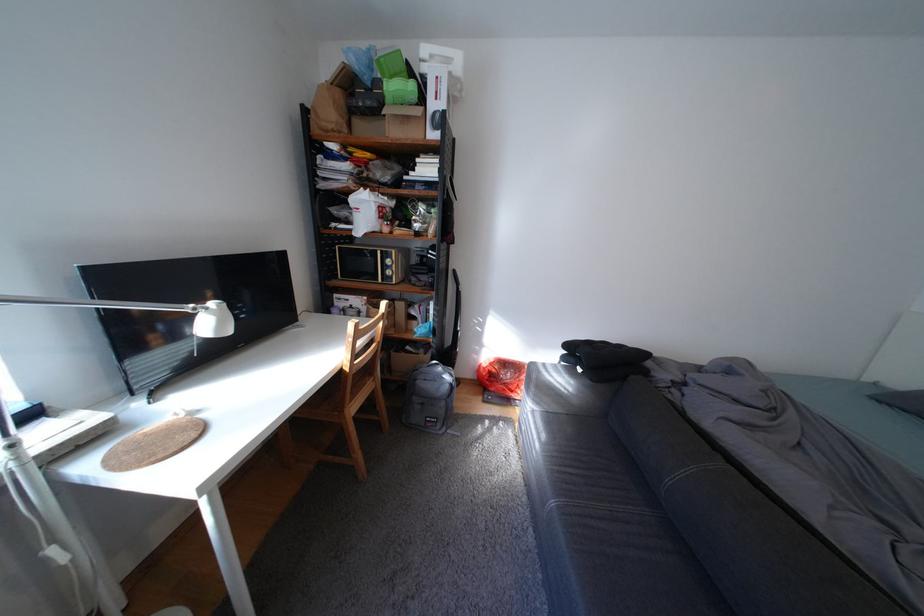
The image size is (924, 616). I want to click on small black box, so click(x=365, y=102).